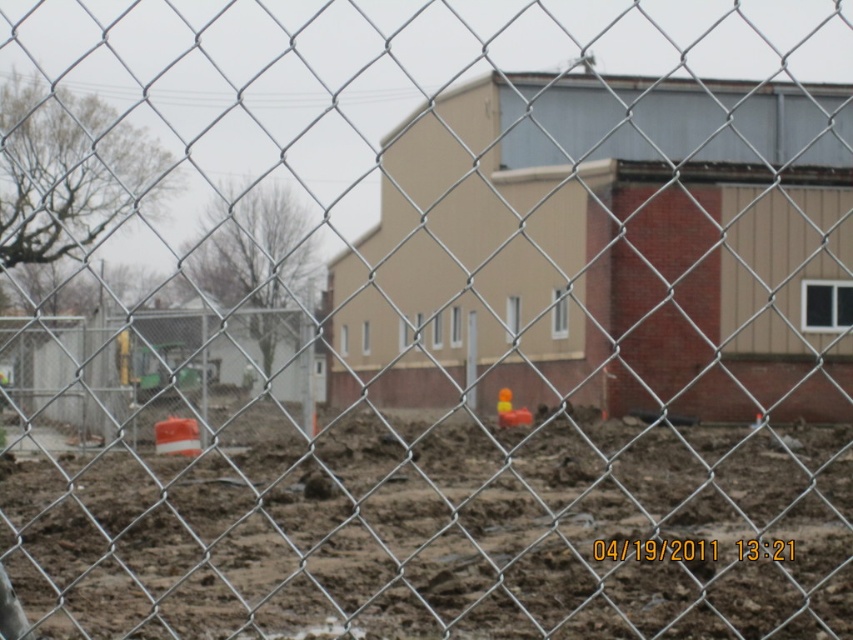
Between brown dirt at center and beige brick building at center, which one appears on the left side from the viewer's perspective?

brown dirt at center is more to the left.

Who is higher up, brown dirt at center or beige brick building at center?

beige brick building at center is higher up.

What do you see at coordinates (444, 534) in the screenshot?
I see `brown dirt at center` at bounding box center [444, 534].

Identify the location of brown dirt at center. [x=444, y=534].